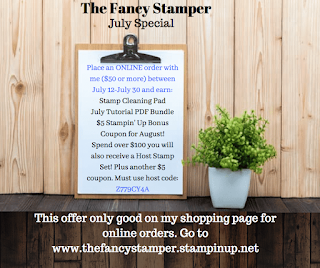
Where is `plant`? plant is located at coordinates (231, 146).